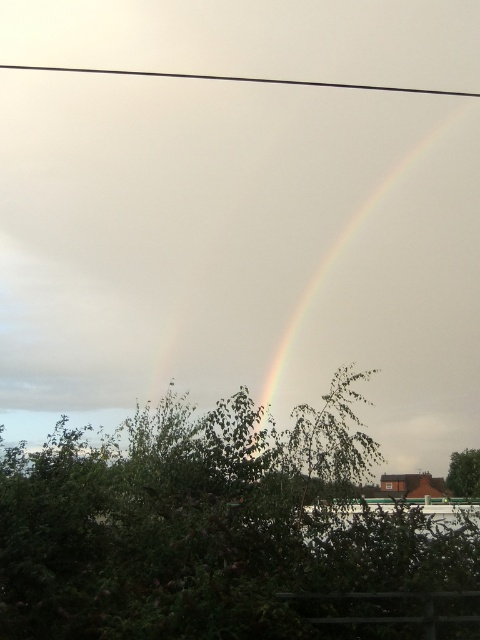
Is green leafy tree at center thinner than green leafy tree at lower right?

No.

Between point (263, 577) and point (475, 449), which one is positioned in front?

Positioned in front is point (263, 577).

This screenshot has height=640, width=480. Describe the element at coordinates (224, 532) in the screenshot. I see `green leafy tree at center` at that location.

Where is `green leafy tree at center`? green leafy tree at center is located at coordinates (224, 532).

Image resolution: width=480 pixels, height=640 pixels. Identify the location of green leafy tree at center. (224, 532).

Which of these two, green leafy tree at center or rainbow at upper center, stands shorter?

Standing shorter between the two is green leafy tree at center.

Who is more forward, (181, 497) or (470, 333)?

Positioned in front is point (181, 497).

I want to click on green leafy tree at center, so click(x=224, y=532).

Does black wire at upper center come in front of green leafy tree at lower right?

No, it is not.

Between black wire at upper center and green leafy tree at lower right, which one is positioned lower?

green leafy tree at lower right is below.

I want to click on black wire at upper center, so click(242, 80).

At what (x,y) coordinates should I click in order to perform the action: click on black wire at upper center. Please return your answer as a coordinate pair (x, y). The image size is (480, 640). Looking at the image, I should click on (242, 80).